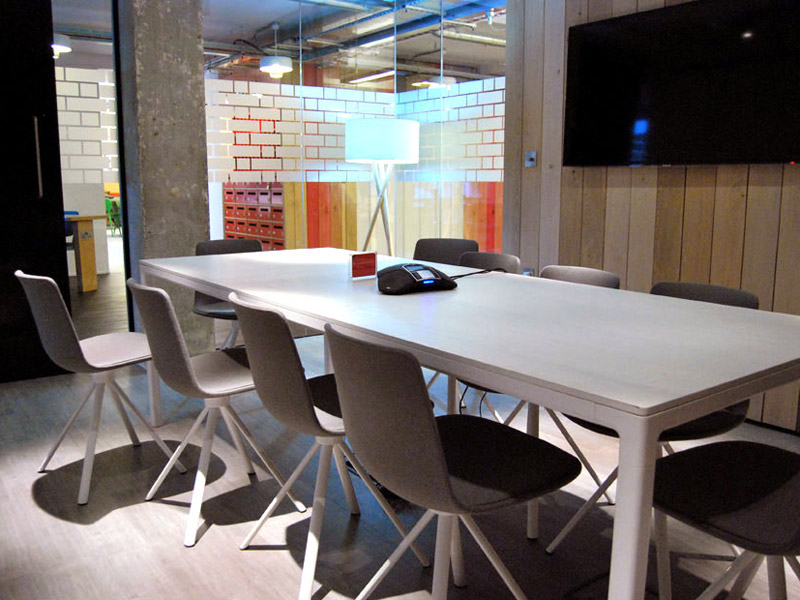
Identify the location of chairs on left side of table. (57, 320), (172, 318), (266, 340), (374, 391).